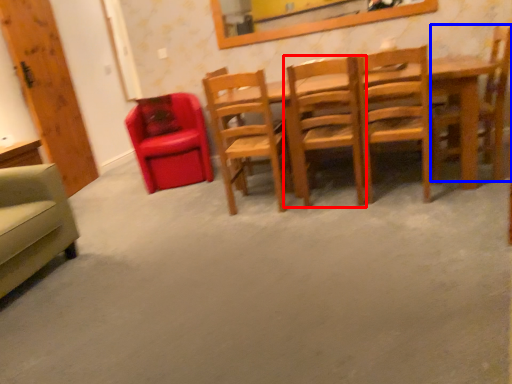
Question: Which object appears farthest to the camera in this image, chair (highlighted by a red box) or chair (highlighted by a blue box)?

Choices:
 (A) chair
 (B) chair

Answer: (B)